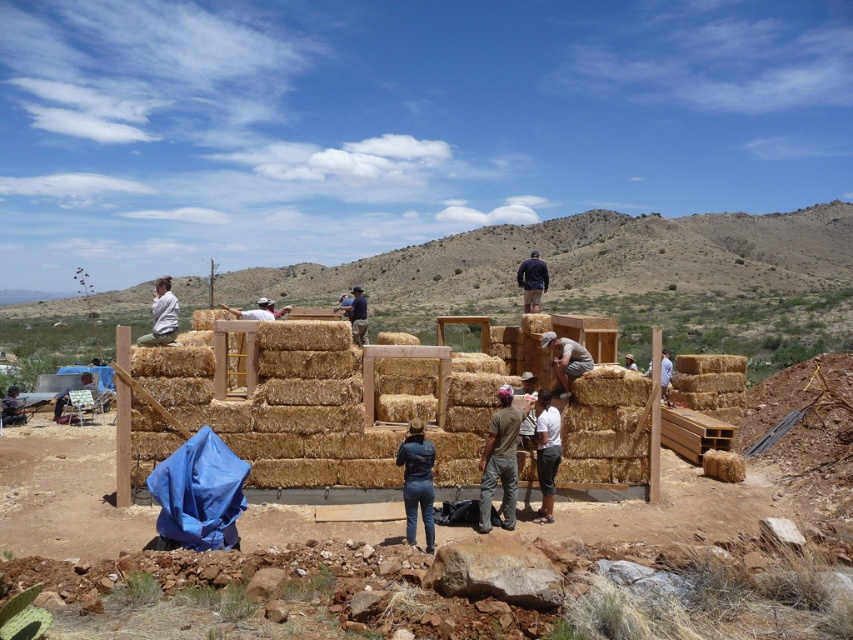
Question: Which object is the closest to the dark blue sweater at center?

Choices:
 (A) dark blue jeans at center
 (B) dark gray fabric pants at lower center
 (C) brown straw bale at center
 (D) brown cotton shirt at center

Answer: (C)

Question: Which point is farther to the camera?

Choices:
 (A) dark gray fabric pants at lower center
 (B) dark blue jeans at center
 (C) dark blue sweater at center

Answer: (C)

Question: Which of these objects is positioned farthest from the brown straw bale at center?

Choices:
 (A) dark blue sweater at center
 (B) natural straw bales at center
 (C) dark blue jeans at center

Answer: (A)

Question: Can you confirm if brown straw bale at center is thinner than dark blue sweater at center?

Choices:
 (A) yes
 (B) no

Answer: (A)

Question: Does dark gray fabric pants at lower center have a larger size compared to white cotton shirt at left?

Choices:
 (A) yes
 (B) no

Answer: (B)

Question: Can you confirm if dark blue jeans at center is positioned to the right of brown straw bale at center?

Choices:
 (A) no
 (B) yes

Answer: (A)